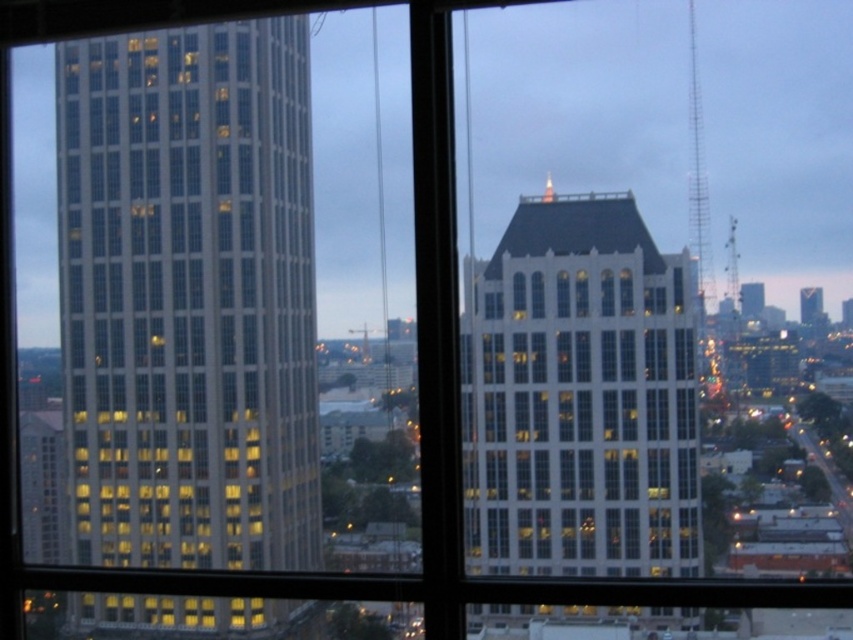
Where is the transparent glass building at left located in the image?

The transparent glass building at left is located at point (189,296) in the image.

You are an architect evaluating the city skyline. Based on the scene, which of the two buildings, the transparent glass building at left or the white glass building at center, has a greater height?

The transparent glass building at left is much taller than the white glass building at center.